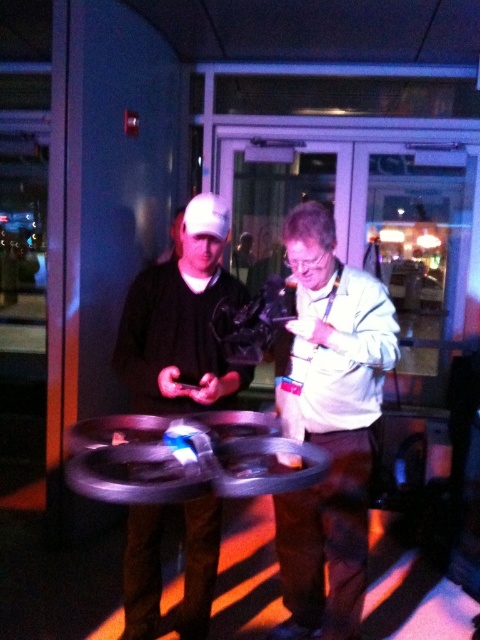
You are a delivery person who needs to place a 1.8 meter long package between the white matte jacket at center and the camera. Can you fit it there without bending the package?

The distance between the white matte jacket at center and the camera is 1.92 meters. Since the package is 1.8 meters long, it can fit between them without bending.

Consider the image. You are a delivery robot with a 50 cm wide package. You need to move from the entrance to the glass door while avoiding obstacles. Can you fit through the space between the white matte jacket at center and the matte black phone at center?

The distance between the white matte jacket at center and the matte black phone at center is 46.05 centimeters. Since the package is 50 cm wide, it is slightly wider than the available space. Therefore, the robot cannot fit through the space between the white matte jacket at center and the matte black phone at center.

You are standing at the origin of the coordinate system in the image. You want to move towards the white matte jacket at center located at point (331, 426). Is there any obstacle between you and the white matte jacket at center?

The white matte jacket at center is located at point (331, 426), and there are no objects mentioned in the scene description that would block the path between the origin and this point. Therefore, there are no obstacles in the way.